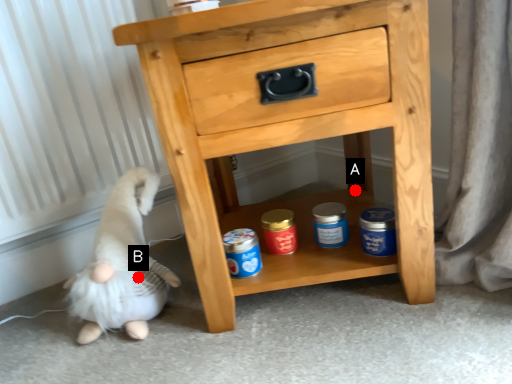
Question: Two points are circled on the image, labeled by A and B beside each circle. Which point is farther from the camera taking this photo?

Choices:
 (A) A is further
 (B) B is further

Answer: (A)